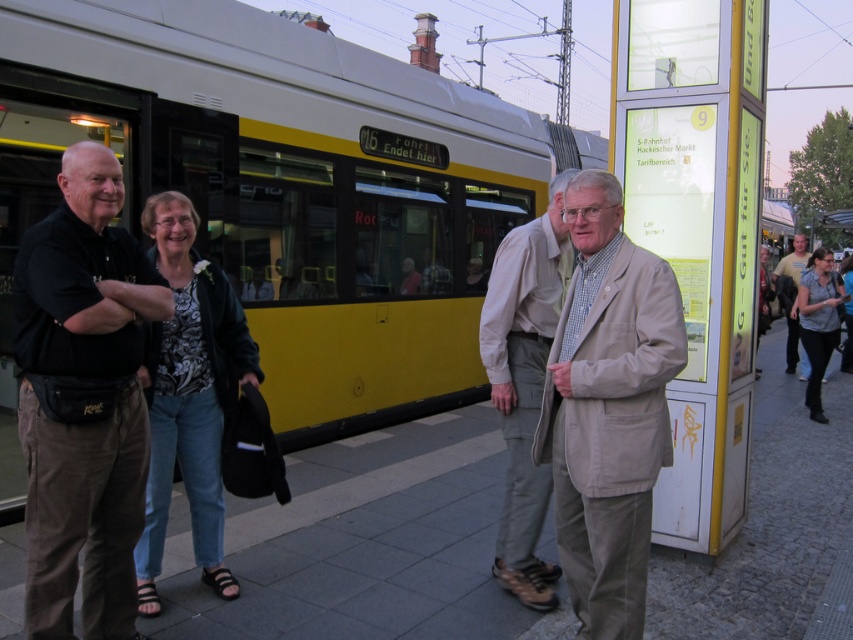
Question: Which object is closer to the camera taking this photo?

Choices:
 (A) black cotton shirt at left
 (B) light blue shirt at right
 (C) light beige jacket at center

Answer: (A)

Question: Which object is closer to the camera taking this photo?

Choices:
 (A) light beige jacket at center
 (B) black cotton shirt at left
 (C) light blue shirt at right
 (D) beige fabric coat at center

Answer: (B)

Question: Considering the real-world distances, which object is farthest from the black cotton shirt at left?

Choices:
 (A) beige fabric coat at center
 (B) light beige jacket at center
 (C) light blue shirt at right

Answer: (C)

Question: Does beige fabric coat at center appear over light beige jacket at center?

Choices:
 (A) yes
 (B) no

Answer: (B)

Question: Can you confirm if black cotton shirt at left is thinner than light beige jacket at center?

Choices:
 (A) yes
 (B) no

Answer: (B)

Question: Does black cotton shirt at left appear on the right side of light beige jacket at center?

Choices:
 (A) no
 (B) yes

Answer: (A)